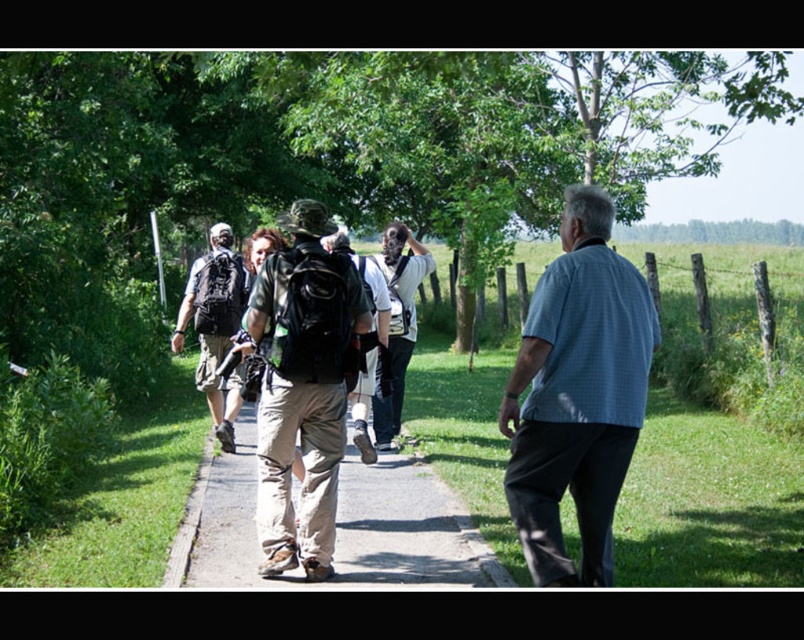
Who is more forward, (216, 268) or (376, 397)?

Positioned in front is point (216, 268).

Does matte black backpack at left have a lesser width compared to white shirt at center?

Incorrect, matte black backpack at left's width is not less than white shirt at center's.

Is point (241, 310) behind point (380, 266)?

That is True.

At what (x,y) coordinates should I click in order to perform the action: click on matte black backpack at left. Please return your answer as a coordinate pair (x, y). The image size is (804, 640). Looking at the image, I should click on (215, 324).

Does blue checkered shirt at right appear on the left side of khaki cotton pants at center?

In fact, blue checkered shirt at right is to the right of khaki cotton pants at center.

Who is lower down, blue checkered shirt at right or khaki cotton pants at center?

khaki cotton pants at center is lower down.

Does point (552, 264) come farther from viewer compared to point (279, 456)?

No, it is not.

Locate an element on the screen. blue checkered shirt at right is located at coordinates (577, 394).

You are a GUI agent. You are given a task and a screenshot of the screen. Output one action in this format:
    pyautogui.click(x=<x>, y=<y>)
    Task: Click on the khaki cotton pants at center
    
    Given the screenshot: What is the action you would take?
    pyautogui.click(x=302, y=387)

Is point (265, 492) in front of point (400, 300)?

Yes, it is.

Locate an element on the screen. The image size is (804, 640). khaki cotton pants at center is located at coordinates 302,387.